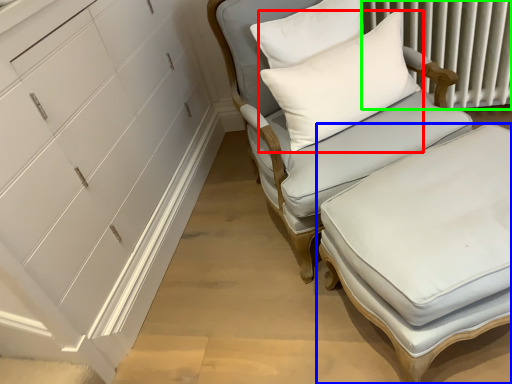
Question: Based on their relative distances, which object is nearer to pillow (highlighted by a red box)? Choose from table (highlighted by a blue box) and radiator (highlighted by a green box).

Choices:
 (A) table
 (B) radiator

Answer: (A)